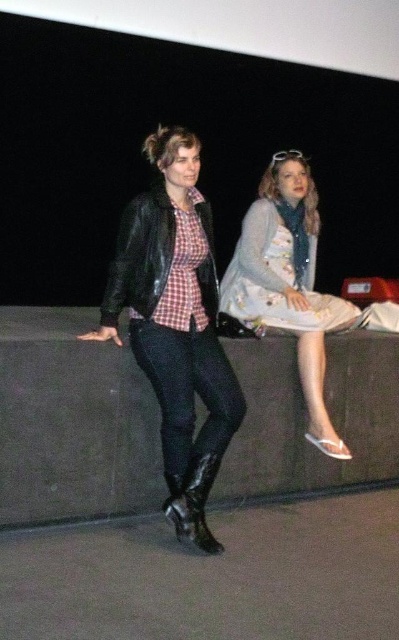
You are designing a storage space for the items in the image. The matte black leather jacket at left and the glossy leather boot at lower left need to be stored. Based on their sizes, which item requires a larger storage compartment?

The matte black leather jacket at left requires a larger storage compartment because its width is greater than the glossy leather boot at lower left.

You are a photographer trying to capture the scene. You notice the matte black leather jacket at left and the glossy leather boot at lower left. Based on their positions, which object is closer to the left edge of the photo?

The matte black leather jacket at left is closer to the left edge of the photo because it is positioned to the left of the glossy leather boot at lower left.

You are standing on the edge of the platform and want to move to the point marked at coordinates point (294, 300). Is this point located behind or in front of the point marked at coordinates point (177, 477)?

The point marked at coordinates point (294, 300) is behind the point marked at coordinates point (177, 477).